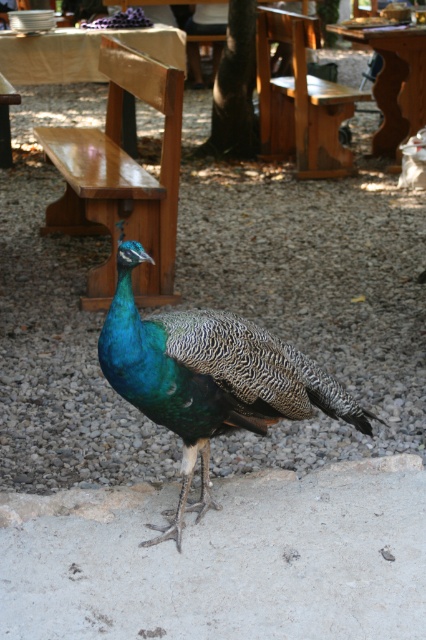
You are standing at the origin point of the image coordinate system. You want to walk to the gray gravel at center. Which direction should you move in terms of x and y coordinates?

The gray gravel at center is located at coordinates point 0.452 in the x direction and 0.732 in the y direction, so you should move towards the right and downward to reach it.

You are a gardener planning to place a small potted plant between the gray gravel at center and the wooden park bench at center. Which material will the plant touch first when placed in the middle?

The gray gravel at center has a smaller size compared to wooden park bench at center, so the plant will touch the gray gravel at center first because it is lower in height than the wooden park bench at center.